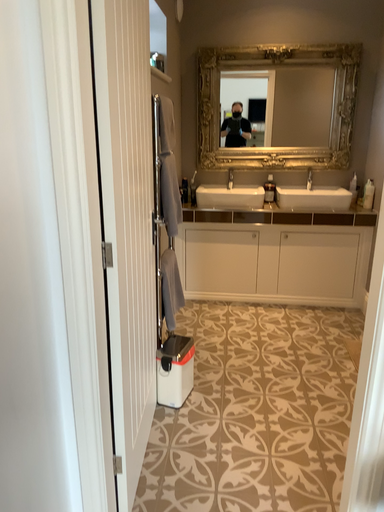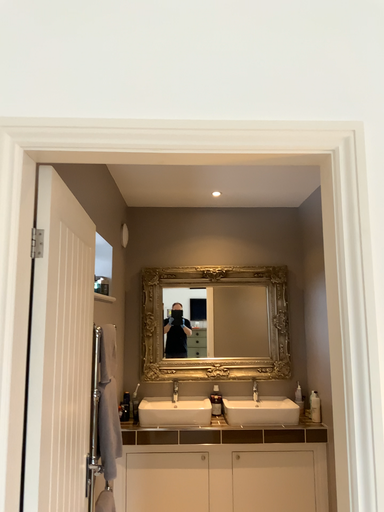
Question: How did the camera likely rotate when shooting the video?

Choices:
 (A) rotated right
 (B) rotated left

Answer: (A)